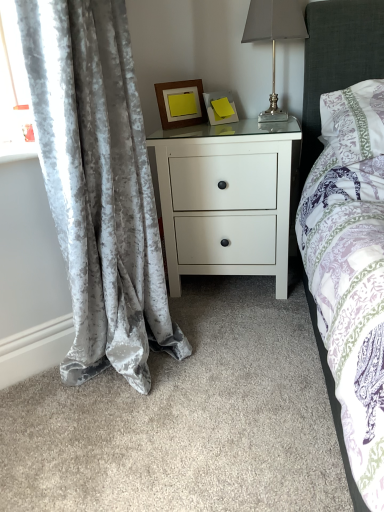
Question: From a real-world perspective, is wooden frame at upper center, the 2th picture frame in the right-to-left sequence, located higher than white matte nightstand at center?

Choices:
 (A) yes
 (B) no

Answer: (A)

Question: From the image's perspective, is wooden frame at upper center, marked as the first picture frame in a left-to-right arrangement, above white matte nightstand at center?

Choices:
 (A) no
 (B) yes

Answer: (B)

Question: Is wooden frame at upper center, the 2th picture frame in the right-to-left sequence, positioned in front of white matte nightstand at center?

Choices:
 (A) no
 (B) yes

Answer: (A)

Question: Is wooden frame at upper center, marked as the first picture frame in a left-to-right arrangement, oriented away from white matte nightstand at center?

Choices:
 (A) no
 (B) yes

Answer: (A)

Question: Can you confirm if wooden frame at upper center, the 2th picture frame in the right-to-left sequence, is positioned to the right of white matte nightstand at center?

Choices:
 (A) yes
 (B) no

Answer: (B)

Question: Visually, is metallic silver table lamp at upper right positioned to the left or to the right of matte yellow picture frame at upper center, placed as the 1th picture frame when sorted from right to left?

Choices:
 (A) left
 (B) right

Answer: (B)

Question: Is point (294, 37) positioned closer to the camera than point (220, 104)?

Choices:
 (A) farther
 (B) closer

Answer: (B)

Question: Is metallic silver table lamp at upper right wider or thinner than matte yellow picture frame at upper center, placed as the 1th picture frame when sorted from right to left?

Choices:
 (A) wide
 (B) thin

Answer: (A)

Question: Is metallic silver table lamp at upper right taller or shorter than matte yellow picture frame at upper center, the 2th picture frame in the left-to-right sequence?

Choices:
 (A) tall
 (B) short

Answer: (A)

Question: Is matte yellow picture frame at upper center, placed as the 1th picture frame when sorted from right to left, to the left or to the right of metallic silver table lamp at upper right in the image?

Choices:
 (A) right
 (B) left

Answer: (B)

Question: Is matte yellow picture frame at upper center, placed as the 1th picture frame when sorted from right to left, spatially inside metallic silver table lamp at upper right, or outside of it?

Choices:
 (A) outside
 (B) inside

Answer: (A)

Question: In the image, is matte yellow picture frame at upper center, placed as the 1th picture frame when sorted from right to left, positioned in front of or behind metallic silver table lamp at upper right?

Choices:
 (A) behind
 (B) front

Answer: (A)

Question: From a real-world perspective, is matte yellow picture frame at upper center, the 2th picture frame in the left-to-right sequence, positioned above or below metallic silver table lamp at upper right?

Choices:
 (A) above
 (B) below

Answer: (B)

Question: Is matte yellow picture frame at upper center, placed as the 1th picture frame when sorted from right to left, taller or shorter than white matte nightstand at center?

Choices:
 (A) tall
 (B) short

Answer: (B)

Question: Is point (203, 99) closer or farther from the camera than point (160, 162)?

Choices:
 (A) farther
 (B) closer

Answer: (A)